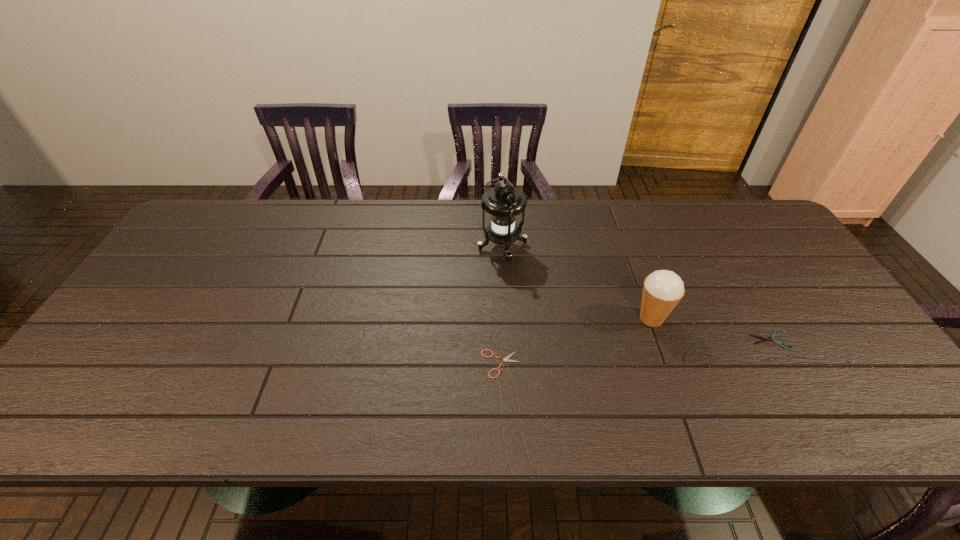
Where is `lantern`? The height and width of the screenshot is (540, 960). lantern is located at coordinates (504, 202).

Find the location of a particular element. the tallest object is located at coordinates (504, 202).

At what (x,y) coordinates should I click in order to perform the action: click on the second object from right to left. Please return your answer as a coordinate pair (x, y). The height and width of the screenshot is (540, 960). Looking at the image, I should click on (663, 289).

Locate an element on the screen. The image size is (960, 540). icecream is located at coordinates (663, 289).

The height and width of the screenshot is (540, 960). Find the location of `the rightmost object`. the rightmost object is located at coordinates (773, 335).

Find the location of a particular element. The width and height of the screenshot is (960, 540). the left shears is located at coordinates (x=506, y=359).

You are a GUI agent. You are given a task and a screenshot of the screen. Output one action in this format:
    pyautogui.click(x=<x>, y=<y>)
    Task: Click on the free spot located 0.300m on the front of the lantern
    The height and width of the screenshot is (540, 960).
    Given the screenshot: What is the action you would take?
    pyautogui.click(x=508, y=351)

Where is `free location located on the front of the second object from right to left`? This screenshot has width=960, height=540. free location located on the front of the second object from right to left is located at coordinates (684, 410).

Where is `free space located 0.080m on the left of the rightmost object`? The width and height of the screenshot is (960, 540). free space located 0.080m on the left of the rightmost object is located at coordinates (719, 340).

Find the location of a particular element. Image resolution: width=960 pixels, height=540 pixels. blank space located 0.300m on the right of the left shears is located at coordinates (647, 364).